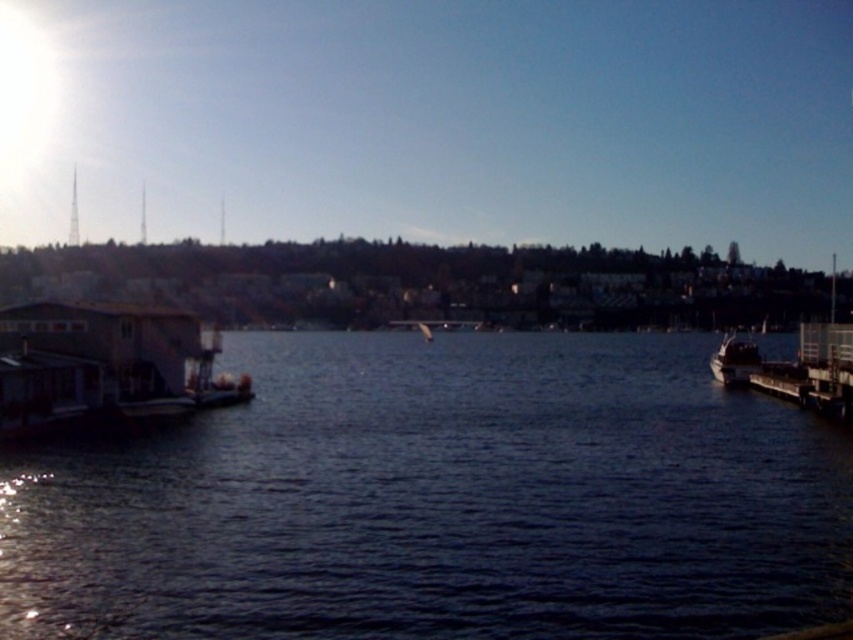
You are a photographer planning to take a photo of the dark blue water at center and the shiny silver boat at right. Which object will appear larger in the photo?

The shiny silver boat at right will appear larger in the photo because it is bigger than the dark blue water at center.